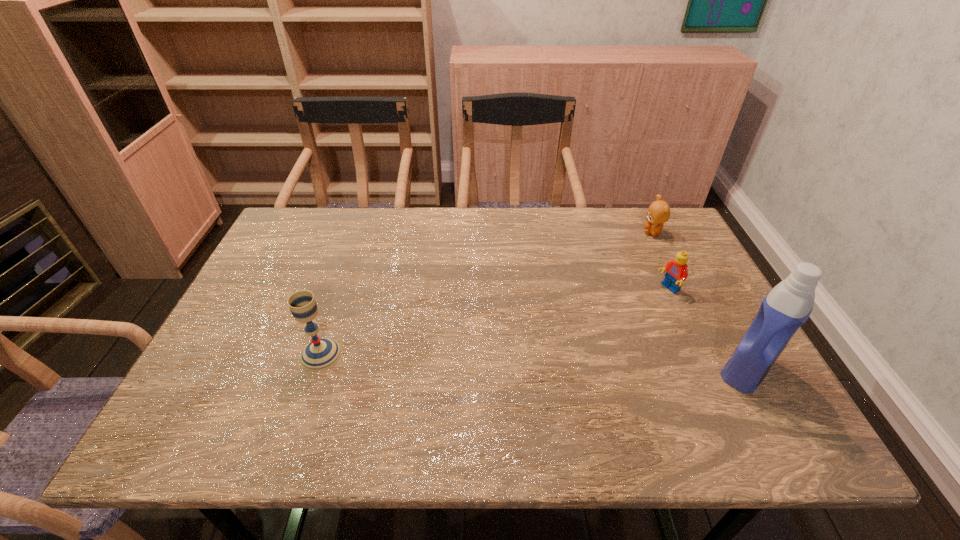
Identify the location of vacant space situated 0.400m on the face of the farthest object. (589, 314).

Where is `free region located 0.220m on the face of the farthest object`? Image resolution: width=960 pixels, height=540 pixels. free region located 0.220m on the face of the farthest object is located at coordinates (619, 276).

I want to click on vacant space located on the face of the farthest object, so click(x=605, y=294).

What are the coordinates of `object that is at the far edge` in the screenshot? It's located at (658, 213).

The height and width of the screenshot is (540, 960). In order to click on object that is positioned at the near edge in this screenshot , I will do `click(788, 305)`.

Where is `detergent that is at the right edge`? This screenshot has width=960, height=540. detergent that is at the right edge is located at coordinates (788, 305).

Where is `Lego that is at the right edge`? This screenshot has width=960, height=540. Lego that is at the right edge is located at coordinates (676, 270).

This screenshot has width=960, height=540. Identify the location of teddy bear that is positioned at the right edge. (658, 213).

This screenshot has width=960, height=540. In order to click on object present at the far right corner in this screenshot , I will do `click(658, 213)`.

I want to click on object present at the near right corner, so click(x=788, y=305).